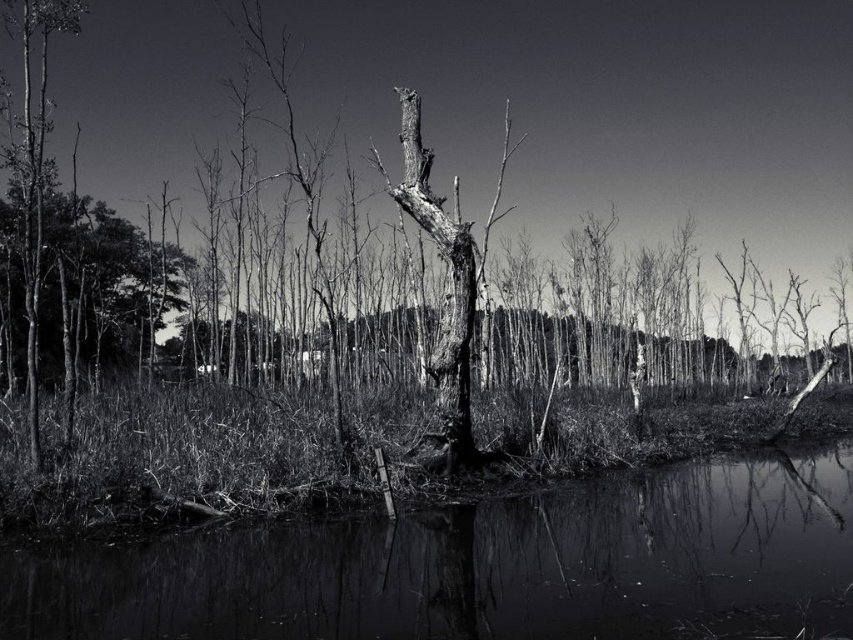
Question: Is smooth bark tree at center closer to camera compared to smooth bark tree at left?

Choices:
 (A) yes
 (B) no

Answer: (B)

Question: Which object is closer to the camera taking this photo?

Choices:
 (A) smooth bark tree at left
 (B) smooth water at center

Answer: (B)

Question: Can you confirm if smooth bark tree at center is bigger than smooth bark tree at left?

Choices:
 (A) no
 (B) yes

Answer: (A)

Question: Which object appears closest to the camera in this image?

Choices:
 (A) smooth bark tree at left
 (B) smooth water at center

Answer: (B)

Question: Which point is farther to the camera?

Choices:
 (A) (459, 349)
 (B) (80, 0)

Answer: (B)

Question: In this image, where is smooth water at center located relative to smooth bark tree at left?

Choices:
 (A) left
 (B) right

Answer: (B)